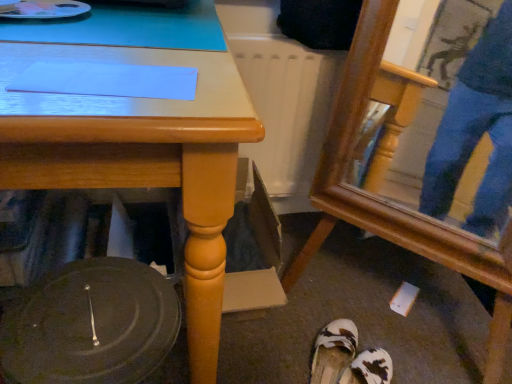
Describe the element at coordinates (385, 175) in the screenshot. I see `wooden swivel chair at lower right` at that location.

What is the approximate width of white textured sandals at lower center, which is the 1th footwear in bottom-to-top order?

white textured sandals at lower center, which is the 1th footwear in bottom-to-top order, is 10.07 inches in width.

Image resolution: width=512 pixels, height=384 pixels. I want to click on white fabric sandals at lower center, the first footwear in the top-to-bottom sequence, so click(333, 351).

Considering the sizes of white textured sandals at lower center, the second footwear when ordered from top to bottom, and matte wood desk at center in the image, is white textured sandals at lower center, the second footwear when ordered from top to bottom, taller or shorter than matte wood desk at center?

In the image, white textured sandals at lower center, the second footwear when ordered from top to bottom, appears to be shorter than matte wood desk at center.

Considering the sizes of white textured sandals at lower center, which is the 1th footwear in bottom-to-top order, and matte wood desk at center in the image, is white textured sandals at lower center, which is the 1th footwear in bottom-to-top order, wider or thinner than matte wood desk at center?

Clearly, white textured sandals at lower center, which is the 1th footwear in bottom-to-top order, has less width compared to matte wood desk at center.

How different are the orientations of white textured sandals at lower center, which is the 1th footwear in bottom-to-top order, and matte wood desk at center in degrees?

The facing directions of white textured sandals at lower center, which is the 1th footwear in bottom-to-top order, and matte wood desk at center are 47.4 degrees apart.

At what (x,y) coordinates should I click in order to perform the action: click on desk located in front of the white textured sandals at lower center, which is the 1th footwear in bottom-to-top order. Please return your answer as a coordinate pair (x, y). The height and width of the screenshot is (384, 512). Looking at the image, I should click on (140, 156).

Is matte wood desk at center shorter than wooden swivel chair at lower right?

Yes.

Is matte wood desk at center bigger or smaller than wooden swivel chair at lower right?

Considering their sizes, matte wood desk at center takes up more space than wooden swivel chair at lower right.

Is matte wood desk at center facing towards wooden swivel chair at lower right?

No, matte wood desk at center does not turn towards wooden swivel chair at lower right.

Are matte wood desk at center and wooden swivel chair at lower right beside each other?

No, matte wood desk at center is not in contact with wooden swivel chair at lower right.

From the image's perspective, which is below, matte wood desk at center or white fabric sandals at lower center, which ranks as the second footwear in bottom-to-top order?

white fabric sandals at lower center, which ranks as the second footwear in bottom-to-top order, is shown below in the image.

How distant is matte wood desk at center from white fabric sandals at lower center, the first footwear in the top-to-bottom sequence?

They are 26.52 inches apart.

From a real-world perspective, which footwear is the 1st one underneath the matte wood desk at center? Please provide its 2D coordinates.

[(333, 351)]

Does matte wood desk at center have a lesser height compared to white fabric sandals at lower center, the first footwear in the top-to-bottom sequence?

In fact, matte wood desk at center may be taller than white fabric sandals at lower center, the first footwear in the top-to-bottom sequence.

Does wooden swivel chair at lower right have a greater width compared to matte wood desk at center?

No.

Can you confirm if wooden swivel chair at lower right is positioned to the left of matte wood desk at center?

No, wooden swivel chair at lower right is not to the left of matte wood desk at center.

Where is `swivel chair above the matte wood desk at center (from the image's perspective)`? The height and width of the screenshot is (384, 512). swivel chair above the matte wood desk at center (from the image's perspective) is located at coordinates (385, 175).

Choose the correct answer: Is wooden swivel chair at lower right inside matte wood desk at center or outside it?

wooden swivel chair at lower right is spatially situated outside matte wood desk at center.

Considering the sizes of objects matte wood desk at center and white textured sandals at lower center, which is the 1th footwear in bottom-to-top order, in the image provided, who is shorter, matte wood desk at center or white textured sandals at lower center, which is the 1th footwear in bottom-to-top order,?

white textured sandals at lower center, which is the 1th footwear in bottom-to-top order.

From the image's perspective, which one is positioned lower, matte wood desk at center or white textured sandals at lower center, which is the 1th footwear in bottom-to-top order?

white textured sandals at lower center, which is the 1th footwear in bottom-to-top order, appears lower in the image.

Which point is more distant from viewer, (207, 300) or (383, 370)?

The point (383, 370) is more distant.

Locate an element on the screen. the 2nd footwear below when counting from the matte wood desk at center (from the image's perspective) is located at coordinates (369, 368).

From the image's perspective, which object appears higher, white fabric sandals at lower center, the first footwear in the top-to-bottom sequence, or matte wood desk at center?

matte wood desk at center appears higher in the image.

Is white fabric sandals at lower center, the first footwear in the top-to-bottom sequence, to the left of matte wood desk at center from the viewer's perspective?

In fact, white fabric sandals at lower center, the first footwear in the top-to-bottom sequence, is to the right of matte wood desk at center.

Identify the location of desk located in front of the white fabric sandals at lower center, which ranks as the second footwear in bottom-to-top order. (140, 156).

Which is behind, wooden swivel chair at lower right or white fabric sandals at lower center, which ranks as the second footwear in bottom-to-top order?

white fabric sandals at lower center, which ranks as the second footwear in bottom-to-top order, is behind.

Between point (378, 62) and point (350, 362), which one is positioned behind?

The point (350, 362) is behind.

From the image's perspective, is wooden swivel chair at lower right located above white fabric sandals at lower center, which ranks as the second footwear in bottom-to-top order?

Correct, wooden swivel chair at lower right appears higher than white fabric sandals at lower center, which ranks as the second footwear in bottom-to-top order, in the image.

The width and height of the screenshot is (512, 384). I want to click on swivel chair that is above the white fabric sandals at lower center, which ranks as the second footwear in bottom-to-top order (from a real-world perspective), so click(385, 175).

This screenshot has width=512, height=384. In the image, there is a white textured sandals at lower center, which is the 1th footwear in bottom-to-top order. Identify the location of desk above it (from the image's perspective). (140, 156).

Find the location of a particular element. Image resolution: width=512 pixels, height=384 pixels. desk below the wooden swivel chair at lower right (from a real-world perspective) is located at coordinates (140, 156).

Looking at the image, which one is located further to wooden swivel chair at lower right, white fabric sandals at lower center, the first footwear in the top-to-bottom sequence, or matte wood desk at center?

Among the two, matte wood desk at center is located further to wooden swivel chair at lower right.

Which object lies nearer to the anchor point wooden swivel chair at lower right, white textured sandals at lower center, which is the 1th footwear in bottom-to-top order, or white fabric sandals at lower center, the first footwear in the top-to-bottom sequence?

white fabric sandals at lower center, the first footwear in the top-to-bottom sequence, lies closer to wooden swivel chair at lower right than the other object.

From the image, which object appears to be nearer to white fabric sandals at lower center, the first footwear in the top-to-bottom sequence, wooden swivel chair at lower right or matte wood desk at center?

wooden swivel chair at lower right.

Which object lies nearer to the anchor point white fabric sandals at lower center, the first footwear in the top-to-bottom sequence, matte wood desk at center or wooden swivel chair at lower right?

Among the two, wooden swivel chair at lower right is located nearer to white fabric sandals at lower center, the first footwear in the top-to-bottom sequence.

Based on the photo, estimate the real-world distances between objects in this image. Which object is further from matte wood desk at center, wooden swivel chair at lower right or white fabric sandals at lower center, which ranks as the second footwear in bottom-to-top order?

Based on the image, white fabric sandals at lower center, which ranks as the second footwear in bottom-to-top order, appears to be further to matte wood desk at center.

Considering their positions, is wooden swivel chair at lower right positioned closer to white textured sandals at lower center, the second footwear when ordered from top to bottom, than matte wood desk at center?

wooden swivel chair at lower right lies closer to white textured sandals at lower center, the second footwear when ordered from top to bottom, than the other object.

Estimate the real-world distances between objects in this image. Which object is further from matte wood desk at center, wooden swivel chair at lower right or white textured sandals at lower center, which is the 1th footwear in bottom-to-top order?

white textured sandals at lower center, which is the 1th footwear in bottom-to-top order.

Looking at the image, which one is located closer to wooden swivel chair at lower right, white fabric sandals at lower center, which ranks as the second footwear in bottom-to-top order, or white textured sandals at lower center, the second footwear when ordered from top to bottom?

white fabric sandals at lower center, which ranks as the second footwear in bottom-to-top order, is closer to wooden swivel chair at lower right.

You are a GUI agent. You are given a task and a screenshot of the screen. Output one action in this format:
    pyautogui.click(x=<x>, y=<y>)
    Task: Click on the footwear between wooden swivel chair at lower right and white textured sandals at lower center, the second footwear when ordered from top to bottom, in the up-down direction
    The image size is (512, 384).
    Given the screenshot: What is the action you would take?
    pyautogui.click(x=333, y=351)

Find the location of a particular element. This screenshot has width=512, height=384. footwear between matte wood desk at center and white textured sandals at lower center, the second footwear when ordered from top to bottom, in the horizontal direction is located at coordinates (333, 351).